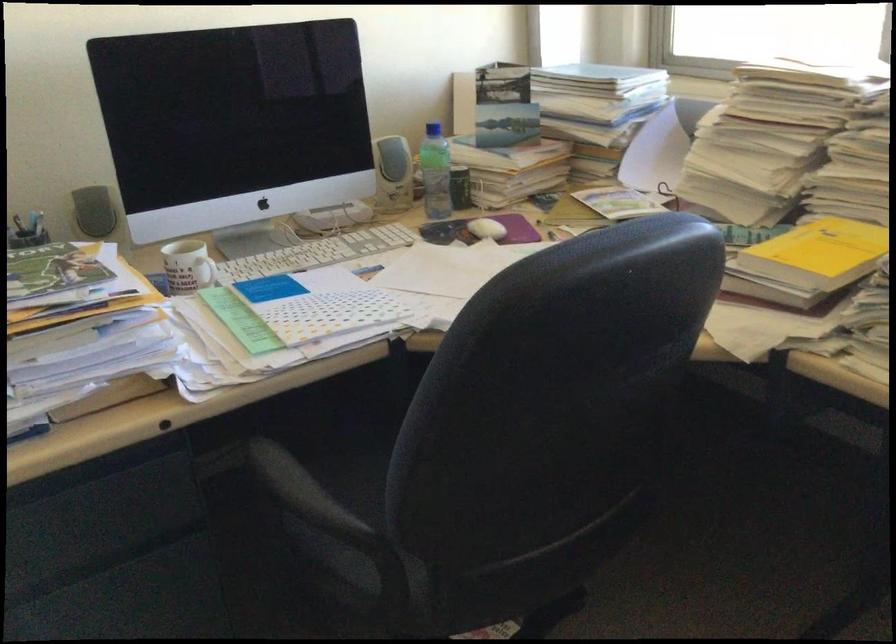
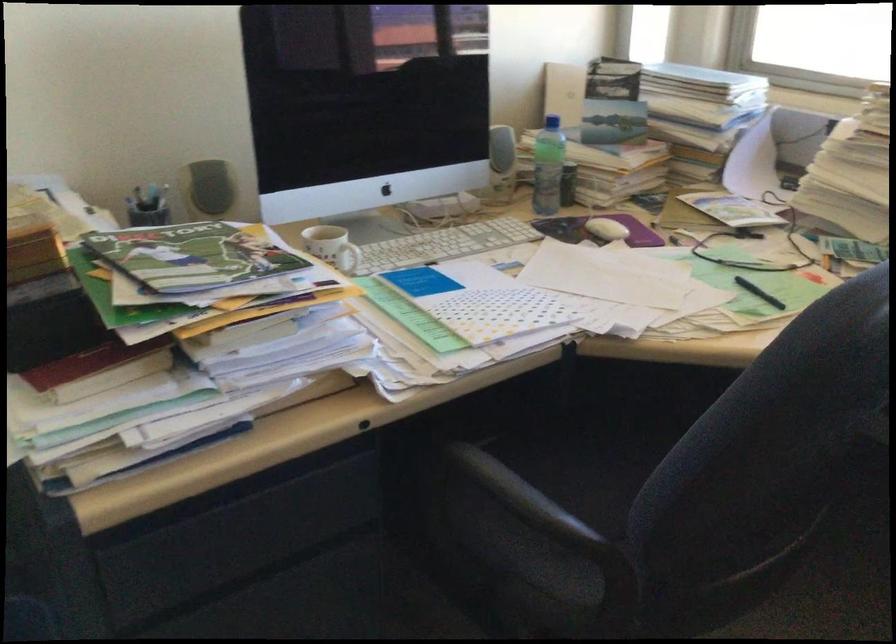
The point at (481,229) is marked in the first image. Where is the corresponding point in the second image?

(606, 229)